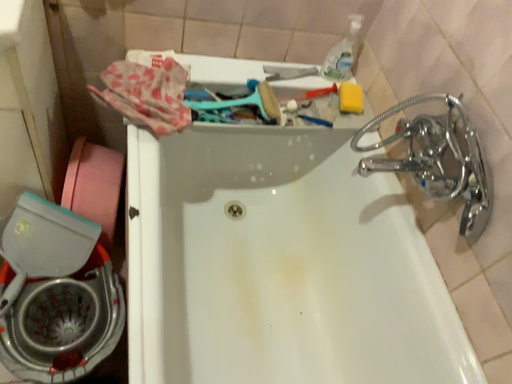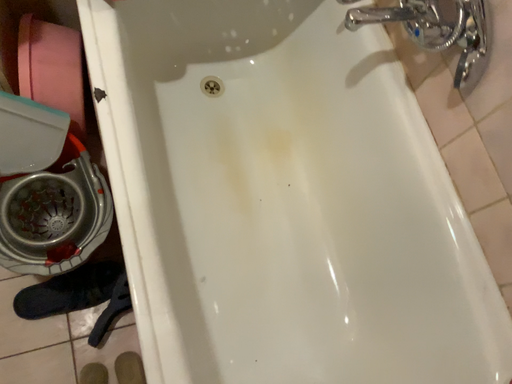
Question: Which way did the camera rotate in the video?

Choices:
 (A) rotated downward
 (B) rotated upward

Answer: (A)